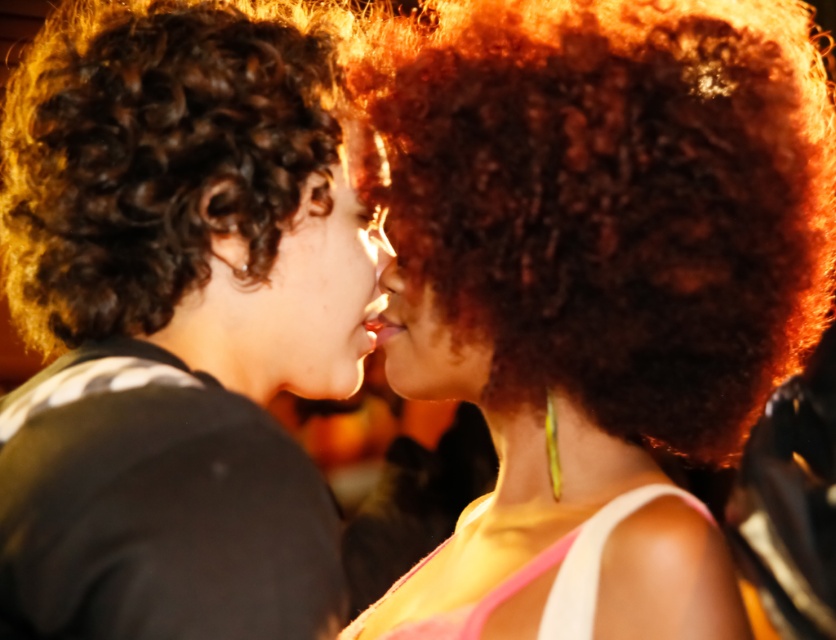
You are a photographer holding a camera. You want to take a photo of the shiny brown hair at center from a distance that is exactly 33.74 inches away. Is the current position of the camera already at the correct distance?

Yes, the shiny brown hair at center and camera are 33.74 inches apart from each other, so the current position of the camera is already at the correct distance.

You are a photographer adjusting lighting for a portrait. You need to ensure both the shiny brown hair at center and the smooth skin face at center are evenly lit. Given their sizes, which object requires more light to maintain proper exposure?

The shiny brown hair at center requires more light because its width is larger than the smooth skin face at center, so it needs more illumination to ensure even exposure.